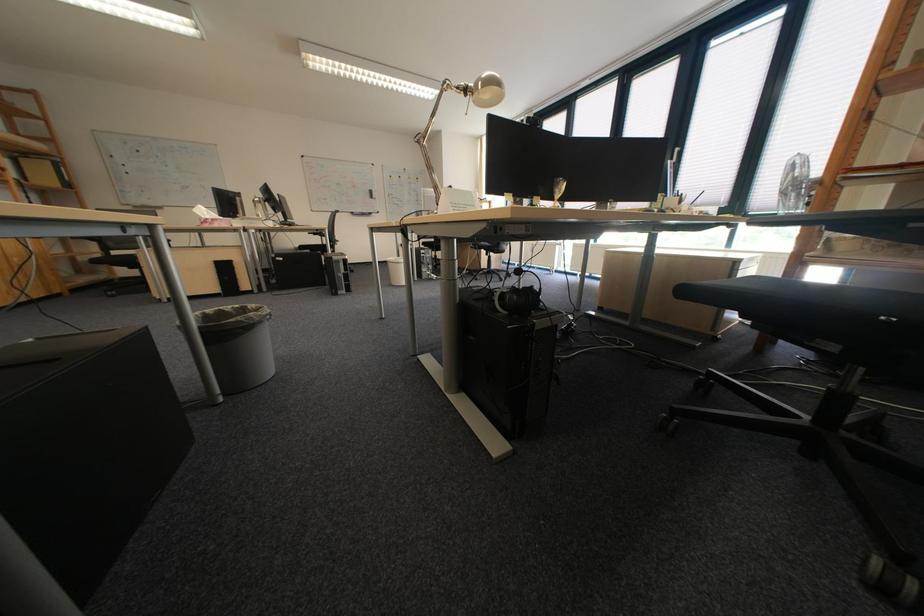
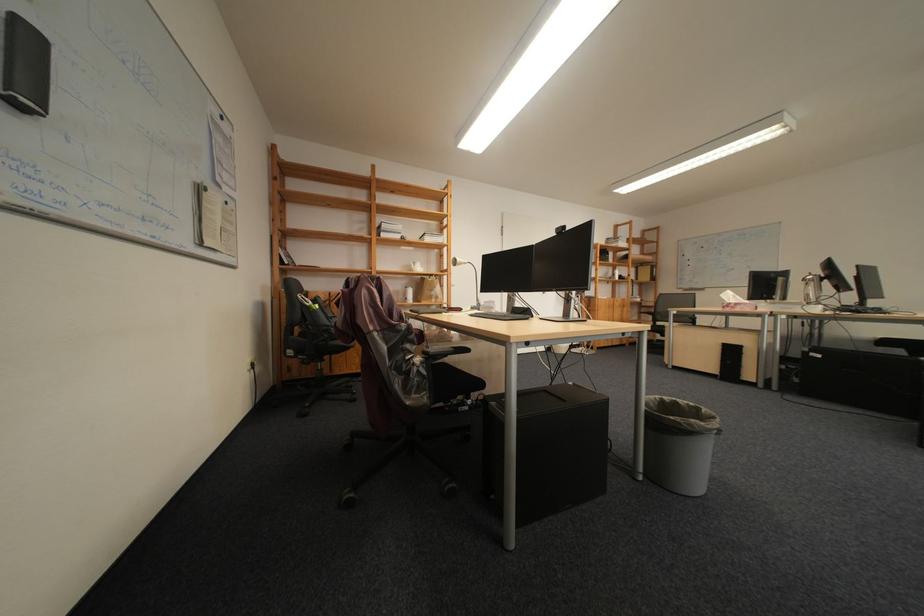
Find the pixel in the second image that matches the point at 213,314 in the first image.

(673, 398)